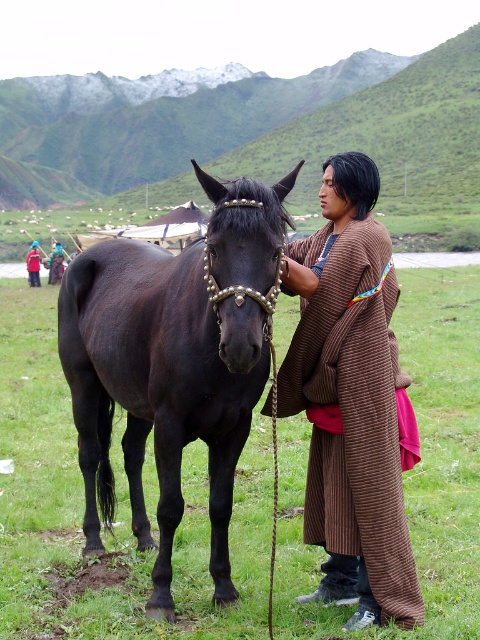
Looking at this image, can you confirm if shiny black horse at center is positioned below brown textured robe at center?

No, shiny black horse at center is not below brown textured robe at center.

Is the position of shiny black horse at center more distant than that of brown textured robe at center?

No, shiny black horse at center is in front of brown textured robe at center.

Who is more distant from viewer, (79,444) or (399,504)?

The point (79,444) is more distant.

Identify the location of shiny black horse at center. Image resolution: width=480 pixels, height=640 pixels. (173, 362).

Does brown textured robe at center have a lesser height compared to red cotton robe at center?

In fact, brown textured robe at center may be taller than red cotton robe at center.

Does brown textured robe at center have a lesser width compared to red cotton robe at center?

Yes, brown textured robe at center is thinner than red cotton robe at center.

Does point (387, 536) lie in front of point (35, 275)?

Yes.

This screenshot has height=640, width=480. I want to click on brown textured robe at center, so click(356, 416).

Does shiny black horse at center appear on the left side of red cotton robe at center?

In fact, shiny black horse at center is to the right of red cotton robe at center.

Measure the distance from shiny black horse at center to red cotton robe at center.

24.76 meters

Between point (260, 364) and point (29, 260), which one is positioned in front?

Positioned in front is point (260, 364).

Identify the location of shiny black horse at center. The image size is (480, 640). (173, 362).